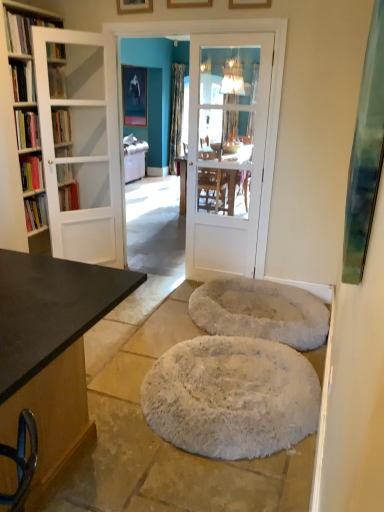
Question: Can you confirm if white glossy door at center, which ranks as the first door in right-to-left order, is positioned to the left of wooden picture frame at upper center, placed as the first picture frame when sorted from right to left?

Choices:
 (A) yes
 (B) no

Answer: (A)

Question: Does white glossy door at center, the 2th door positioned from the left, lie behind wooden picture frame at upper center, placed as the first picture frame when sorted from right to left?

Choices:
 (A) yes
 (B) no

Answer: (A)

Question: Is white glossy door at center, the 2th door positioned from the left, looking in the opposite direction of wooden picture frame at upper center, the first picture frame when ordered from front to back?

Choices:
 (A) yes
 (B) no

Answer: (B)

Question: Does white glossy door at center, which ranks as the first door in right-to-left order, have a smaller size compared to wooden picture frame at upper center, the fourth picture frame positioned from the left?

Choices:
 (A) yes
 (B) no

Answer: (B)

Question: Is white glossy door at center, the 2th door positioned from the left, shorter than wooden picture frame at upper center, the 4th picture frame viewed from the top?

Choices:
 (A) no
 (B) yes

Answer: (A)

Question: Can you confirm if white glossy door at center, the 2th door positioned from the left, is taller than wooden picture frame at upper center, the 4th picture frame viewed from the top?

Choices:
 (A) yes
 (B) no

Answer: (A)

Question: Does wooden picture frame at upper center, which is the 3th picture frame from right to left, contain wooden picture frame at upper center, which is counted as the first picture frame, starting from the bottom?

Choices:
 (A) no
 (B) yes

Answer: (A)

Question: Is wooden picture frame at upper center, the 3th picture frame when ordered from front to back, in contact with wooden picture frame at upper center, placed as the first picture frame when sorted from right to left?

Choices:
 (A) no
 (B) yes

Answer: (A)

Question: Does wooden picture frame at upper center, the second picture frame viewed from the top, have a greater width compared to wooden picture frame at upper center, which is counted as the first picture frame, starting from the bottom?

Choices:
 (A) no
 (B) yes

Answer: (B)

Question: From the image's perspective, is wooden picture frame at upper center, which appears as the 2th picture frame when viewed from the left, on top of wooden picture frame at upper center, the fourth picture frame positioned from the left?

Choices:
 (A) no
 (B) yes

Answer: (B)

Question: Could you tell me if wooden picture frame at upper center, the second picture frame viewed from the top, is facing wooden picture frame at upper center, which is counted as the first picture frame, starting from the bottom?

Choices:
 (A) yes
 (B) no

Answer: (B)

Question: Is wooden picture frame at upper center, the second picture frame viewed from the top, facing away from wooden picture frame at upper center, the fourth picture frame positioned from the left?

Choices:
 (A) yes
 (B) no

Answer: (B)

Question: Does wooden picture frame at upper center, which ranks as the 3th picture frame in back-to-front order, contain matte white bookshelf at upper left, the 3th book positioned from the bottom?

Choices:
 (A) yes
 (B) no

Answer: (B)